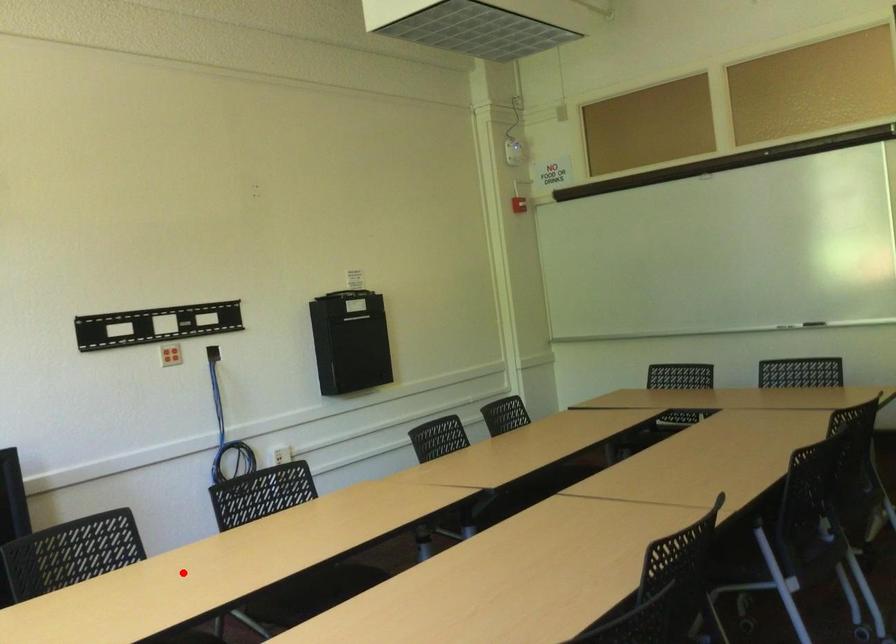
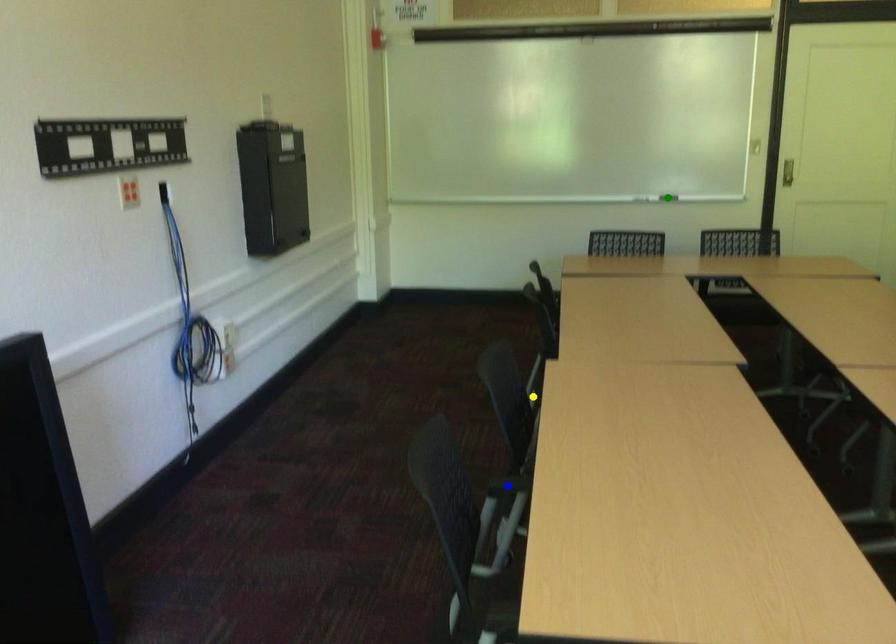
Question: I am providing you with two images of the same scene from different viewpoints. A red point is marked on the first image. You are given multiple points on the second image. Can you choose the point in image 2 that corresponds to the point in image 1?

Choices:
 (A) green point
 (B) yellow point
 (C) blue point

Answer: (C)